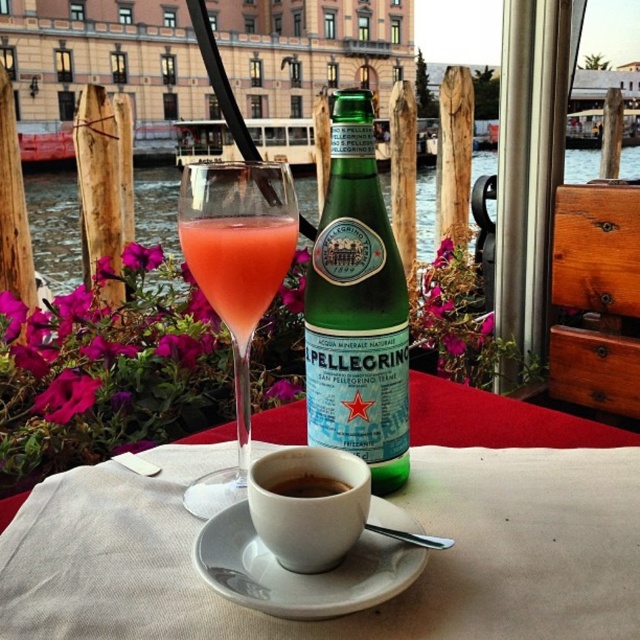
Between translucent glass wine glass at center and white ceramic saucer at center, which one is positioned higher?

translucent glass wine glass at center

Can you confirm if translucent glass wine glass at center is shorter than white ceramic saucer at center?

In fact, translucent glass wine glass at center may be taller than white ceramic saucer at center.

What do you see at coordinates (236, 280) in the screenshot? I see `translucent glass wine glass at center` at bounding box center [236, 280].

This screenshot has height=640, width=640. What are the coordinates of `translucent glass wine glass at center` in the screenshot? It's located at (236, 280).

Which is above, matte white cup at center or brown matte cup at center?

Positioned higher is brown matte cup at center.

Can you confirm if matte white cup at center is smaller than brown matte cup at center?

Actually, matte white cup at center might be larger than brown matte cup at center.

You are a GUI agent. You are given a task and a screenshot of the screen. Output one action in this format:
    pyautogui.click(x=<x>, y=<y>)
    Task: Click on the matte white cup at center
    
    Given the screenshot: What is the action you would take?
    [x=308, y=504]

Where is `matte white cup at center`? matte white cup at center is located at coordinates (308, 504).

Can you confirm if white ceramic cup at center is wider than translucent glass wine glass at center?

Indeed, white ceramic cup at center has a greater width compared to translucent glass wine glass at center.

Can you confirm if white ceramic cup at center is bigger than translucent glass wine glass at center?

Yes.

The image size is (640, 640). In order to click on white ceramic cup at center in this screenshot , I will do `click(387, 497)`.